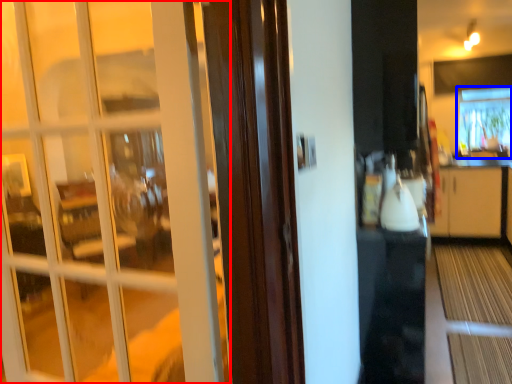
Question: Among these objects, which one is nearest to the camera, door (highlighted by a red box) or window (highlighted by a blue box)?

Choices:
 (A) door
 (B) window

Answer: (A)